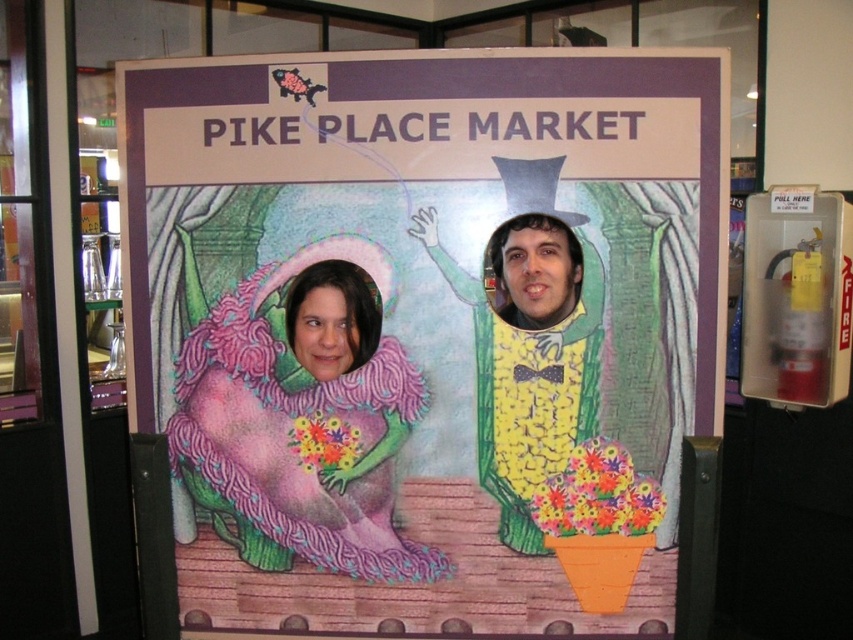
Is pink fuzzy dress at center wider than yellow matte corn at center?

Indeed, pink fuzzy dress at center has a greater width compared to yellow matte corn at center.

Which is in front, point (328, 300) or point (556, 296)?

Positioned in front is point (556, 296).

Where is `pink fuzzy dress at center`? pink fuzzy dress at center is located at coordinates (300, 426).

Does matte cardboard poster at center appear on the right side of yellow matte corn at center?

No, matte cardboard poster at center is not to the right of yellow matte corn at center.

Who is more distant from viewer, (x=323, y=364) or (x=519, y=512)?

The point (x=323, y=364) is behind.

This screenshot has height=640, width=853. I want to click on matte cardboard poster at center, so click(422, 332).

Based on the photo, who is positioned more to the left, matte cardboard poster at center or pink fuzzy dress at center?

pink fuzzy dress at center

This screenshot has height=640, width=853. Find the location of `matte cardboard poster at center`. matte cardboard poster at center is located at coordinates (422, 332).